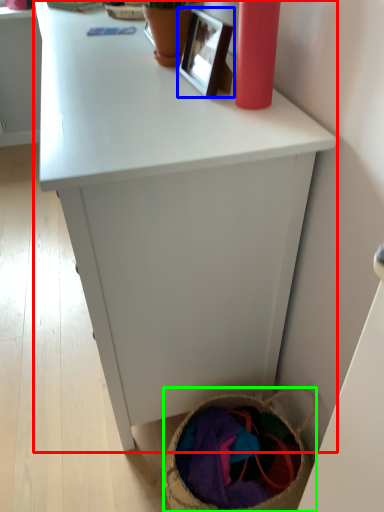
Question: Which object is positioned closest to desk (highlighted by a red box)? Select from picture frame (highlighted by a blue box) and basket (highlighted by a green box).

Choices:
 (A) picture frame
 (B) basket

Answer: (A)